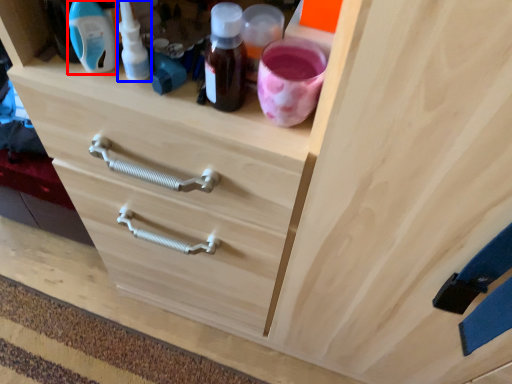
Question: Which point is closer to the camera, bottle (highlighted by a red box) or bottle (highlighted by a blue box)?

Choices:
 (A) bottle
 (B) bottle

Answer: (A)